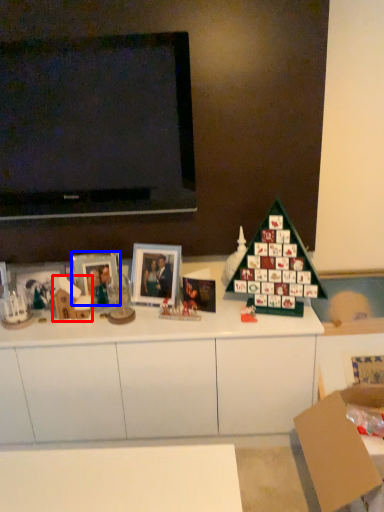
Question: Which point is further to the camera, toy (highlighted by a red box) or picture frame (highlighted by a blue box)?

Choices:
 (A) toy
 (B) picture frame

Answer: (B)